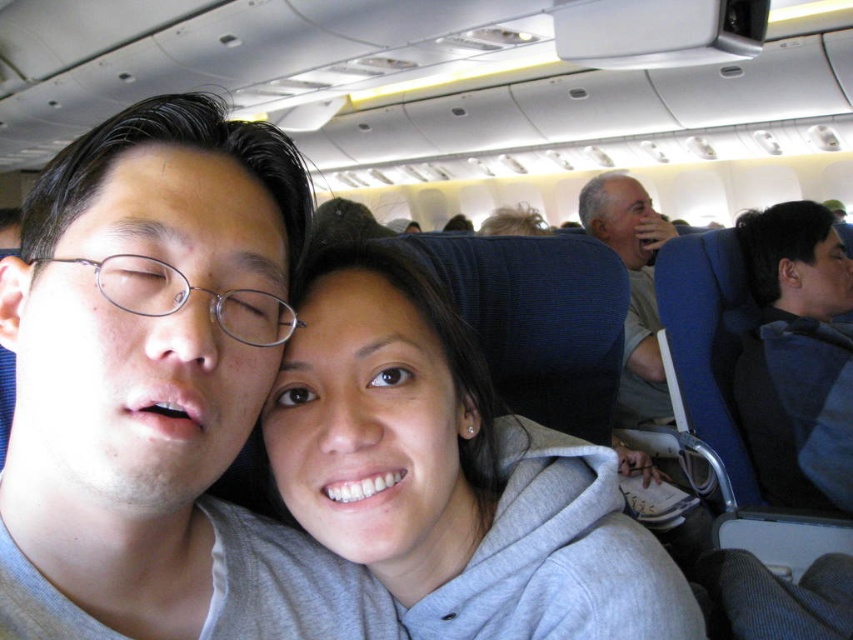
Question: Which object is closer to the camera taking this photo?

Choices:
 (A) gray fleece at center
 (B) dark blue fabric at right
 (C) matte gray hoodie at center
 (D) gray cotton shirt at upper right

Answer: (C)

Question: Is matte gray hoodie at center thinner than gray cotton shirt at upper right?

Choices:
 (A) no
 (B) yes

Answer: (B)

Question: Which point is farther from the camera taking this photo?

Choices:
 (A) (753, 380)
 (B) (315, 429)

Answer: (A)

Question: Which point is farther to the camera?

Choices:
 (A) (614, 579)
 (B) (660, 408)
 (C) (144, 346)

Answer: (B)

Question: Observing the image, what is the correct spatial positioning of matte gray hoodie at center in reference to gray fleece at center?

Choices:
 (A) right
 (B) left

Answer: (B)

Question: Can you confirm if dark blue fabric at right is positioned to the left of gray cotton shirt at upper right?

Choices:
 (A) yes
 (B) no

Answer: (B)